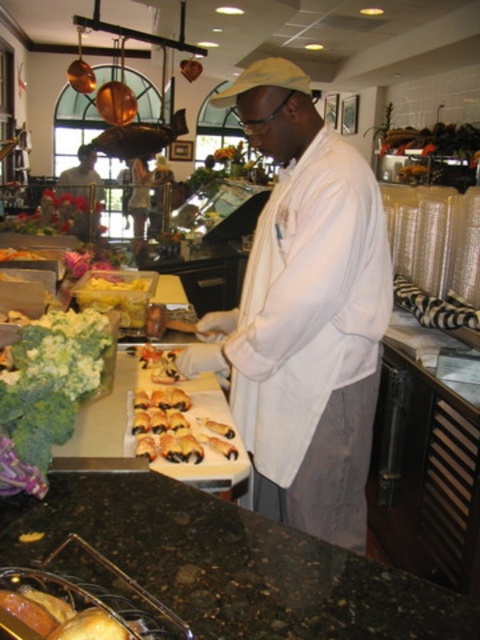
You are a customer in the deli and want to point out the matte orange cheese at center to the chef. Which direction should you indicate relative to the matte white shirt at center?

The matte white shirt at center is to the left of the matte orange cheese at center, so you should indicate to the right of the matte white shirt at center to point out the matte orange cheese at center.

You are a customer at the deli and you want to buy the cheese that takes up more space on the counter. Which cheese should you choose between the yellow cheese at center and the matte orange cheese at center?

The yellow cheese at center is larger in size than the matte orange cheese at center, so you should choose the yellow cheese at center as it takes up more space on the counter.

You are a customer observing the scene. You notice the matte white shirt at center and the matte orange cheese at center. Which object is closer to you?

The matte white shirt at center is closer to you because it is positioned over the matte orange cheese at center.